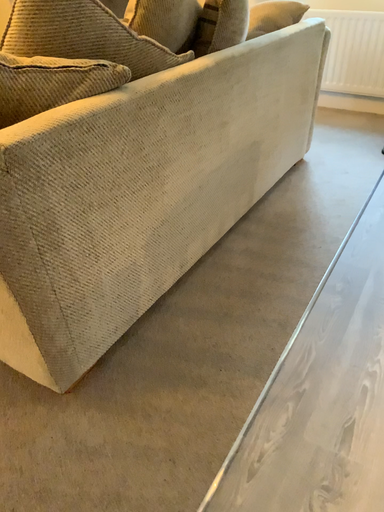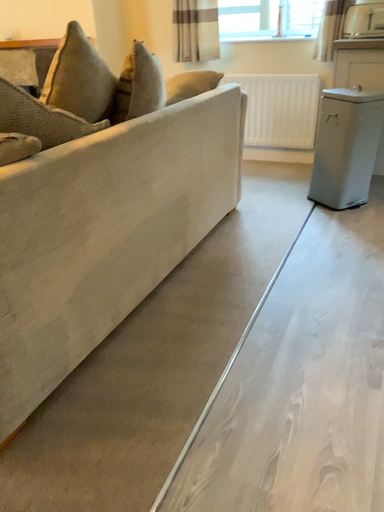
Question: Which way did the camera rotate in the video?

Choices:
 (A) rotated downward
 (B) rotated upward

Answer: (B)